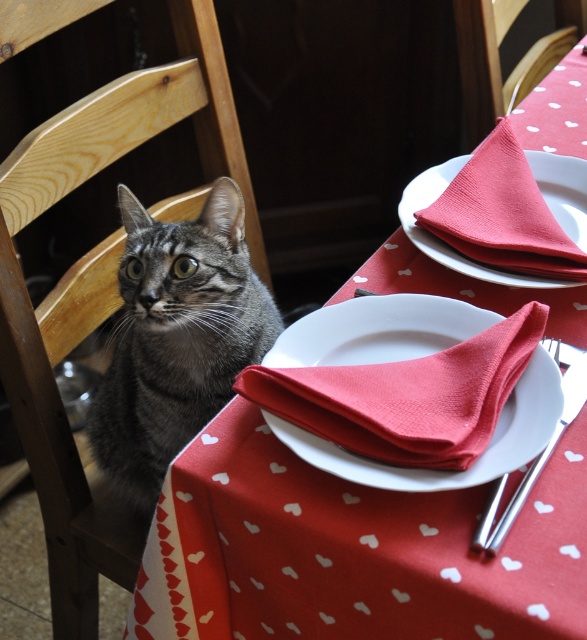
Is gray tabby cat at left to the left of red paper napkin at center from the viewer's perspective?

Indeed, gray tabby cat at left is positioned on the left side of red paper napkin at center.

Can you confirm if gray tabby cat at left is shorter than red paper napkin at center?

No, gray tabby cat at left is not shorter than red paper napkin at center.

Does point (140, 442) come farther from viewer compared to point (583, 170)?

Yes, it is behind point (583, 170).

Identify the location of gray tabby cat at left. (177, 337).

Is red paper napkin at center to the right of shiny metallic fork at lower right from the viewer's perspective?

Correct, you'll find red paper napkin at center to the right of shiny metallic fork at lower right.

Is point (406, 228) positioned behind point (504, 486)?

That is True.

Does point (579, 282) come farther from viewer compared to point (578, 388)?

Yes.

The image size is (587, 640). I want to click on red paper napkin at center, so click(x=444, y=244).

Can you confirm if gray tabby cat at left is positioned above shiny metallic fork at lower right?

Yes.

Is point (157, 362) positioned before point (490, 520)?

No.

Is point (224, 324) closer to viewer compared to point (585, 400)?

No, (224, 324) is behind (585, 400).

I want to click on gray tabby cat at left, so click(177, 337).